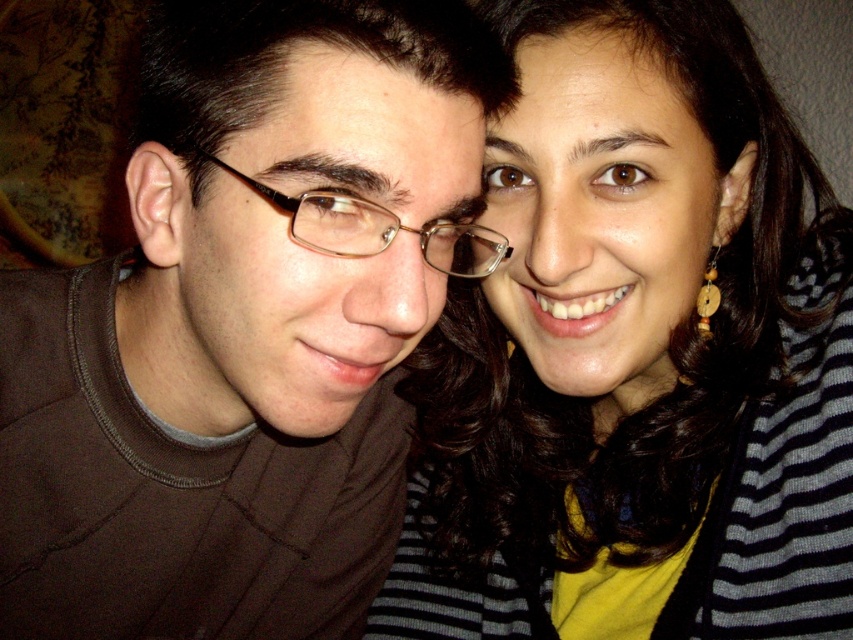
You are standing in front of the image and want to determine which of the two points, point [401,163] or point [553,536], is nearer to you. Based on the scene description, which point is closer?

Point [401,163] is closer to the viewer than point [553,536].

Consider the image. You are a photographer adjusting the lighting for a portrait. You notice the matte brown shirt at center and the gold metallic glasses at center. Which object should you focus on first if you want to highlight the reflection on the glasses while keeping the shirt visible?

The gold metallic glasses at center should be focused on first since they are positioned above the matte brown shirt at center, making them more prominent in the frame. This allows the reflection to be captured effectively while the shirt remains visible below.

You are a photographer standing at a distance of 2 meters from the scene. You want to take a closeup shot of the matte brown shirt at center. Given that the shirt is 41.56 centimeters from the viewer, will you need to move closer or farther away to focus on it properly?

The matte brown shirt at center is already 41.56 centimeters from the viewer, so you do not need to move closer or farther away to focus on it properly.